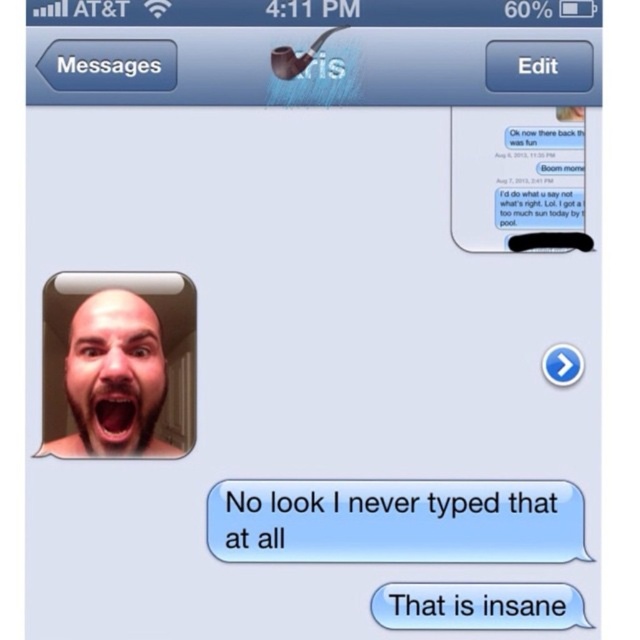
You are looking at a phone screen showing a chat with someone. There is a white paper text message at center and a bald head at upper left in the profile picture. Which object is nearer to your eyes?

The white paper text message at center is closer to the viewer than bald head at upper left.

You are trying to send a longer message using the blue glossy text bubble at center. However, you notice there is also a white paper text message at center in the same area. Which one has a greater width?

The white paper text message at center has a greater width than the blue glossy text bubble at center.

You are looking at the image of the messaging app screen. There are two points marked on the screen. The first point is at coordinate point (547, 486) and the second point is at coordinate point (157, 394). Which point is closer to you?

Point (547, 486) is in front of point (157, 394), so the first point is closer to you.